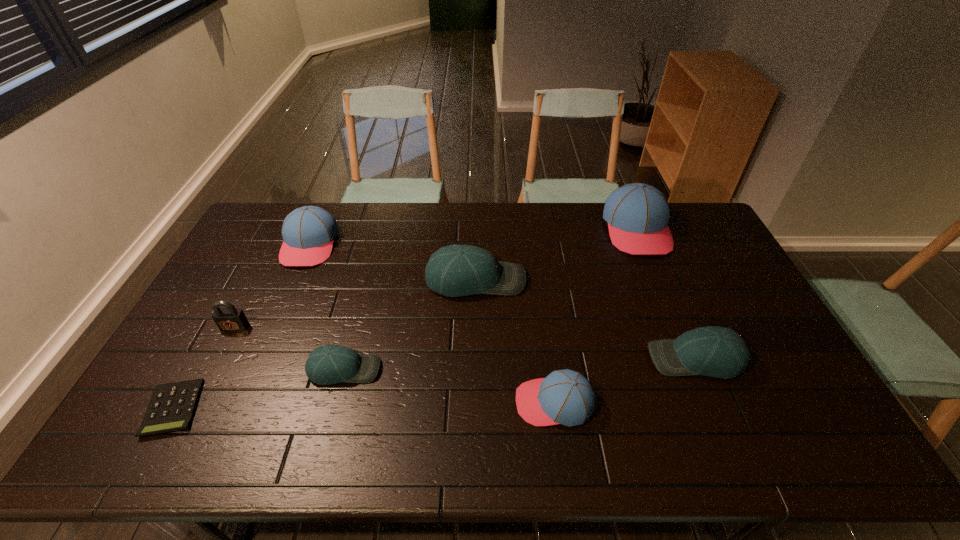
Where is `free space between the rightmost light baseball cap and the padlock`? The width and height of the screenshot is (960, 540). free space between the rightmost light baseball cap and the padlock is located at coordinates (466, 343).

Locate an element on the screen. This screenshot has height=540, width=960. vacant area between the biggest light baseball cap and the second smallest light baseball cap is located at coordinates (586, 319).

Identify the location of free space between the leftmost blue baseball cap and the fifth nearest object. (273, 286).

Where is `vacant point located between the second smallest light baseball cap and the fourth farthest object`? Image resolution: width=960 pixels, height=540 pixels. vacant point located between the second smallest light baseball cap and the fourth farthest object is located at coordinates (466, 343).

At what (x,y) coordinates should I click in order to perform the action: click on vacant point located between the farthest light baseball cap and the smallest blue baseball cap. Please return your answer as a coordinate pair (x, y). This screenshot has height=540, width=960. Looking at the image, I should click on (515, 341).

I want to click on free space between the fifth nearest object and the second smallest light baseball cap, so click(x=466, y=343).

The width and height of the screenshot is (960, 540). I want to click on free point between the farthest light baseball cap and the tallest baseball cap, so click(556, 254).

Locate an element on the screen. The image size is (960, 540). object that stands as the fourth closest to the second biggest blue baseball cap is located at coordinates (172, 406).

Locate an element on the screen. This screenshot has height=540, width=960. object that is the second closest to the smallest blue baseball cap is located at coordinates (456, 270).

Point out which baseball cap is positioned as the fourth nearest to the tallest baseball cap. Please provide its 2D coordinates. Your answer should be formatted as a tuple, i.e. [(x, y)], where the tuple contains the x and y coordinates of a point satisfying the conditions above.

[(330, 364)]